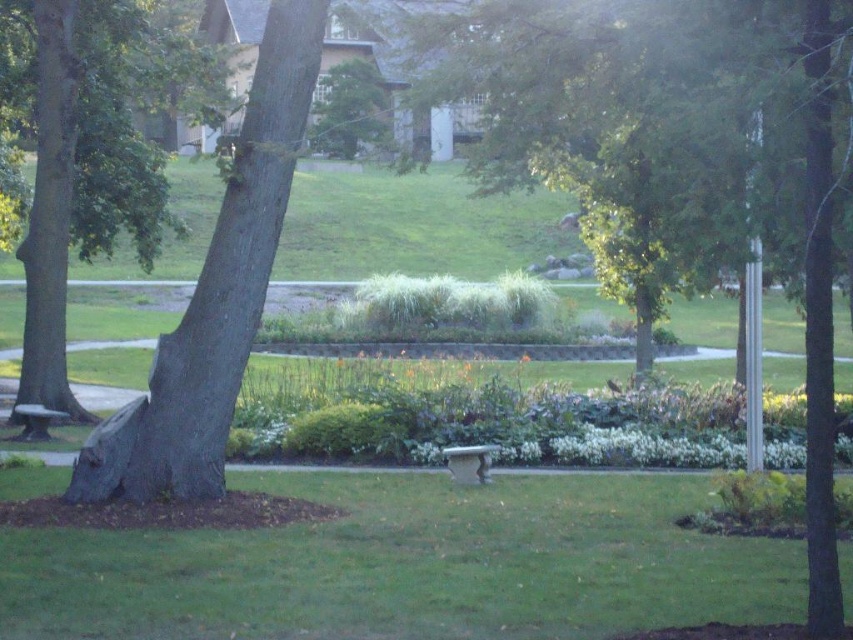
Who is shorter, green leafy tree at center or stone bench at center?

stone bench at center

Does green leafy tree at center have a lesser height compared to stone bench at center?

Incorrect, green leafy tree at center's height does not fall short of stone bench at center's.

Where is `green leafy tree at center`? The width and height of the screenshot is (853, 640). green leafy tree at center is located at coordinates [676, 157].

Which is below, green leafy tree at center or green rough bark tree at left?

green leafy tree at center is below.

Measure the distance between green leafy tree at center and green rough bark tree at left.

green leafy tree at center is 6.28 meters away from green rough bark tree at left.

What do you see at coordinates (676, 157) in the screenshot? I see `green leafy tree at center` at bounding box center [676, 157].

The height and width of the screenshot is (640, 853). I want to click on green leafy tree at center, so click(x=676, y=157).

Image resolution: width=853 pixels, height=640 pixels. Describe the element at coordinates (215, 296) in the screenshot. I see `smooth gray tree trunk at left` at that location.

Image resolution: width=853 pixels, height=640 pixels. In order to click on smooth gray tree trunk at left in this screenshot , I will do `click(215, 296)`.

At what (x,y) coordinates should I click in order to perform the action: click on smooth gray tree trunk at left. Please return your answer as a coordinate pair (x, y). The image size is (853, 640). Looking at the image, I should click on (215, 296).